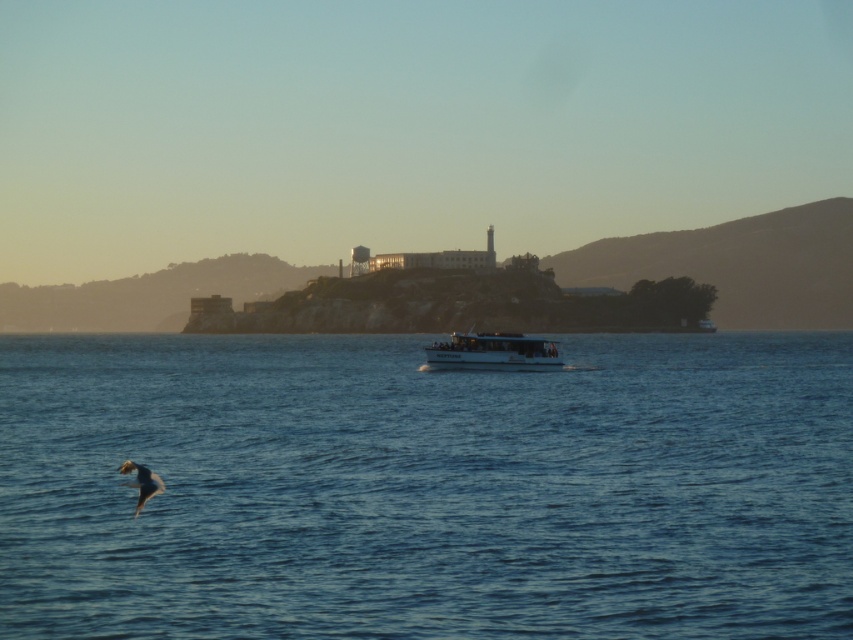
Question: Which point is farther from the camera taking this photo?

Choices:
 (A) (461, 364)
 (B) (125, 458)

Answer: (A)

Question: Does blue water at center appear on the right side of white matte boat at center?

Choices:
 (A) no
 (B) yes

Answer: (A)

Question: Which point is closer to the camera?

Choices:
 (A) blue water at center
 (B) white matte boat at center

Answer: (A)

Question: Does blue water at center come behind white matte boat at center?

Choices:
 (A) no
 (B) yes

Answer: (A)

Question: Is blue water at center positioned in front of white matte boat at center?

Choices:
 (A) yes
 (B) no

Answer: (A)